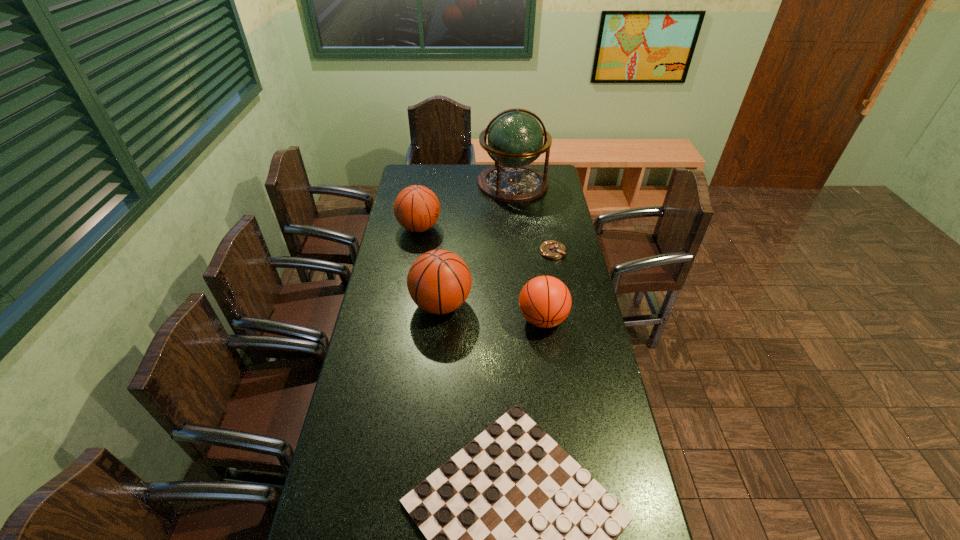
What are the coordinates of `vacant area that lies between the farthest basketball and the farthest object` in the screenshot? It's located at (466, 206).

The image size is (960, 540). Find the location of `free space between the rightmost basketball and the fifth nearest object`. free space between the rightmost basketball and the fifth nearest object is located at coordinates (481, 273).

At what (x,y) coordinates should I click in order to perform the action: click on free space between the farthest basketball and the rightmost basketball. Please return your answer as a coordinate pair (x, y). The image size is (960, 540). Looking at the image, I should click on (481, 273).

Point out which object is positioned as the fourth nearest to the third farthest object. Please provide its 2D coordinates. Your answer should be formatted as a tuple, i.e. [(x, y)], where the tuple contains the x and y coordinates of a point satisfying the conditions above.

[(416, 208)]

Image resolution: width=960 pixels, height=540 pixels. I want to click on object that is the second closest one to the rightmost basketball, so click(551, 249).

Locate which basketball is the second closest to the globe. Please provide its 2D coordinates. Your answer should be formatted as a tuple, i.e. [(x, y)], where the tuple contains the x and y coordinates of a point satisfying the conditions above.

[(439, 281)]

Where is `the closest basketball to the farthest basketball`? The image size is (960, 540). the closest basketball to the farthest basketball is located at coordinates (439, 281).

Find the location of a particular element. free region that satisfies the following two spatial constraints: 1. on the back side of the fourth nearest object; 2. on the right side of the rightmost basketball is located at coordinates (533, 252).